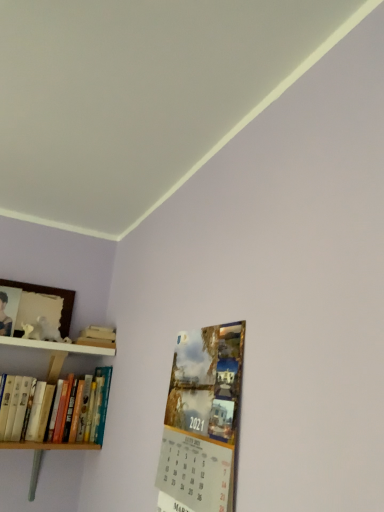
Question: From the image's perspective, is wooden shelf at upper left above or below matte paper calendar at lower right?

Choices:
 (A) above
 (B) below

Answer: (A)

Question: Considering the positions of wooden shelf at upper left and matte paper calendar at lower right in the image, is wooden shelf at upper left bigger or smaller than matte paper calendar at lower right?

Choices:
 (A) big
 (B) small

Answer: (B)

Question: Estimate the real-world distances between objects in this image. Which object is closer to the matte paper calendar at lower right?

Choices:
 (A) wooden shelf at upper left
 (B) hardcover books at left

Answer: (B)

Question: Which object is positioned farthest from the matte paper calendar at lower right?

Choices:
 (A) hardcover books at left
 (B) wooden shelf at upper left

Answer: (B)